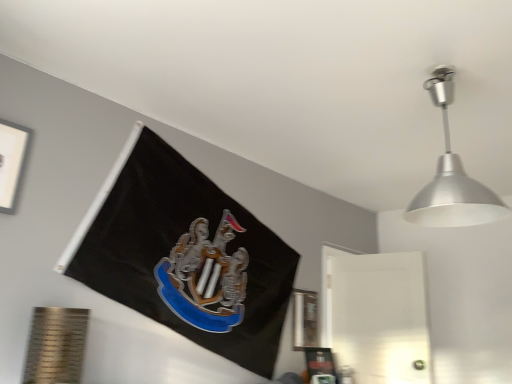
Question: In terms of width, does silver metallic lampshade at upper right look wider or thinner when compared to metallic silver picture frame at lower right, which ranks as the second picture frame in top-to-bottom order?

Choices:
 (A) thin
 (B) wide

Answer: (B)

Question: Is silver metallic lampshade at upper right to the left or to the right of metallic silver picture frame at lower right, which ranks as the second picture frame in top-to-bottom order, in the image?

Choices:
 (A) left
 (B) right

Answer: (B)

Question: Which object is positioned closest to the silver metallic lampshade at upper right?

Choices:
 (A) white matte picture frame at upper left, the second picture frame when ordered from back to front
 (B) metallic silver picture frame at lower right, arranged as the second picture frame when viewed from the left

Answer: (B)

Question: Which is nearer to the silver metallic lampshade at upper right?

Choices:
 (A) metallic silver picture frame at lower right, which is counted as the 1th picture frame, starting from the back
 (B) white matte picture frame at upper left, which is the 2th picture frame from right to left

Answer: (A)